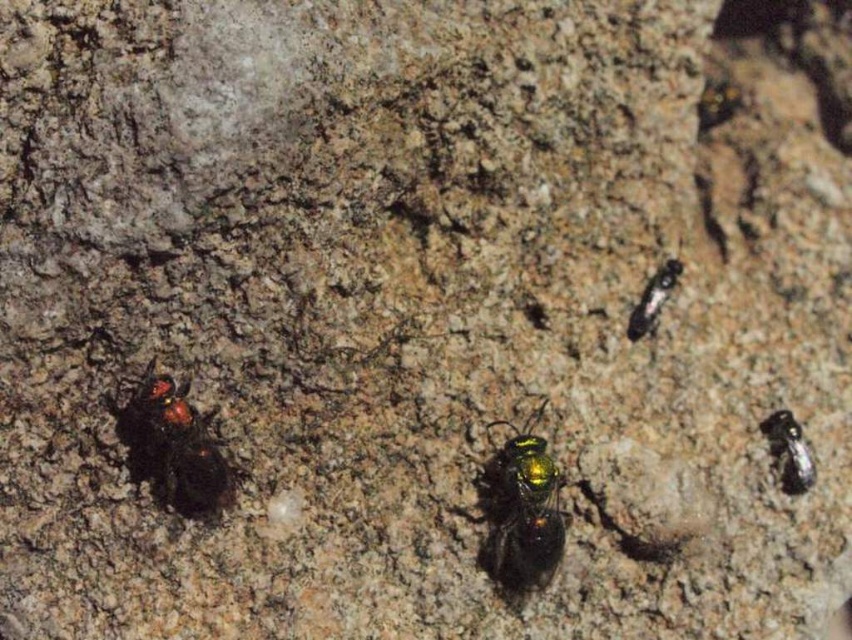
Question: Does metallic green insect at lower left have a lesser width compared to metallic green insect at center-right?

Choices:
 (A) yes
 (B) no

Answer: (B)

Question: Which point is closer to the camera taking this photo?

Choices:
 (A) click(665, 273)
 (B) click(130, 426)
 (C) click(804, 472)
 (D) click(519, 502)

Answer: (B)

Question: Which point is closer to the camera taking this photo?

Choices:
 (A) (543, 486)
 (B) (154, 451)
 (C) (677, 280)

Answer: (B)

Question: Can you confirm if metallic green bee at center is wider than metallic green insect at lower right?

Choices:
 (A) no
 (B) yes

Answer: (B)

Question: Among these points, which one is nearest to the camera?

Choices:
 (A) (678, 276)
 (B) (141, 476)
 (C) (804, 492)

Answer: (B)

Question: Observing the image, what is the correct spatial positioning of metallic green insect at lower left in reference to metallic green insect at lower right?

Choices:
 (A) below
 (B) above

Answer: (B)